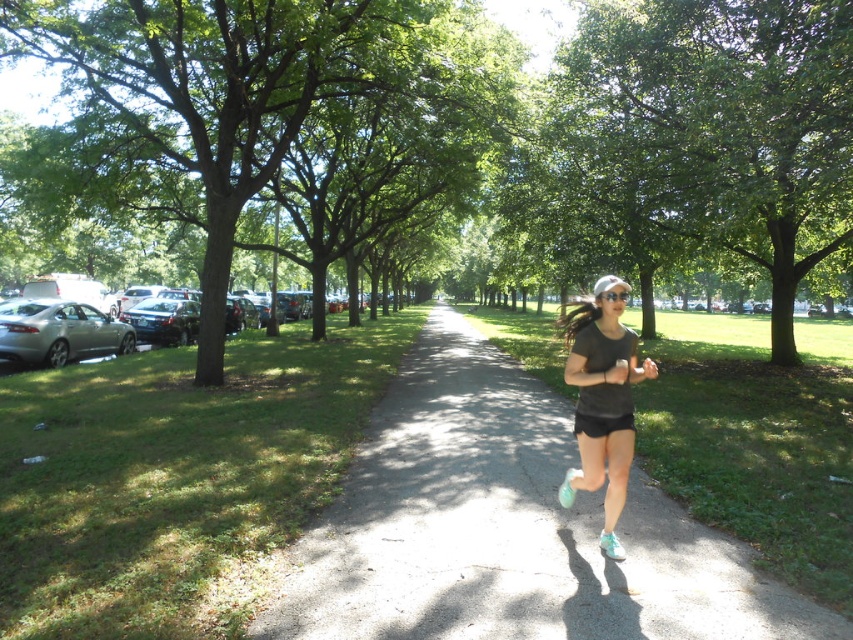
Between dark gray matte t-shirt at center and teal fabric running shoe at lower center, which one is positioned lower?

teal fabric running shoe at lower center is lower down.

Does dark gray matte t-shirt at center have a lesser width compared to teal fabric running shoe at lower center?

Incorrect, dark gray matte t-shirt at center's width is not less than teal fabric running shoe at lower center's.

Where is `dark gray matte t-shirt at center`? Image resolution: width=853 pixels, height=640 pixels. dark gray matte t-shirt at center is located at coordinates (602, 390).

Measure the distance between matte gray asphalt path at center and camera.

10.60 feet

Is matte gray asphalt path at center to the left of dark gray matte t-shirt at center from the viewer's perspective?

Yes, matte gray asphalt path at center is to the left of dark gray matte t-shirt at center.

Between point (601, 637) and point (573, 376), which one is positioned in front?

Point (601, 637) is more forward.

Identify the location of matte gray asphalt path at center. (508, 529).

Is point (607, 410) farther from viewer compared to point (567, 474)?

No, it is not.

Does dark gray matte t-shirt at center appear over white matte running shoe at center?

Yes, dark gray matte t-shirt at center is above white matte running shoe at center.

Between point (583, 307) and point (560, 496), which one is positioned behind?

Positioned behind is point (560, 496).

What are the coordinates of `dark gray matte t-shirt at center` in the screenshot? It's located at (602, 390).